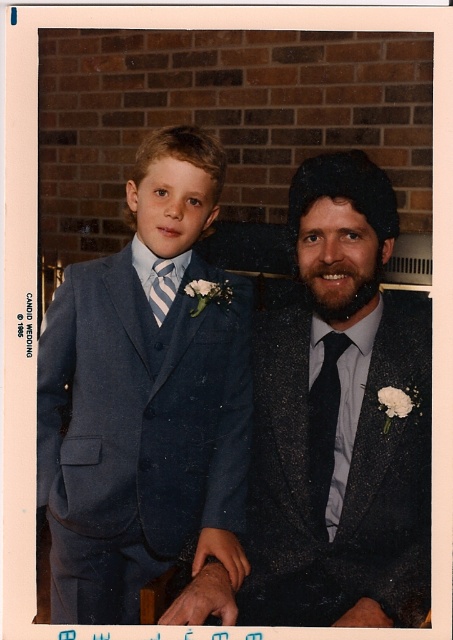
Question: Can you confirm if black satin tie at center is positioned below striped fabric tie at left?

Choices:
 (A) no
 (B) yes

Answer: (B)

Question: Which object is the farthest from the striped fabric tie at left?

Choices:
 (A) matte blue suit at left
 (B) matte black suit at center

Answer: (B)

Question: Is black satin tie at center wider than striped fabric tie at left?

Choices:
 (A) no
 (B) yes

Answer: (B)

Question: Among these objects, which one is nearest to the camera?

Choices:
 (A) striped fabric tie at left
 (B) matte black suit at center
 (C) black satin tie at center
 (D) matte blue suit at left

Answer: (B)

Question: Is matte blue suit at left below black satin tie at center?

Choices:
 (A) yes
 (B) no

Answer: (B)

Question: Which of the following is the farthest from the observer?

Choices:
 (A) striped fabric tie at left
 (B) matte black suit at center
 (C) black satin tie at center

Answer: (A)